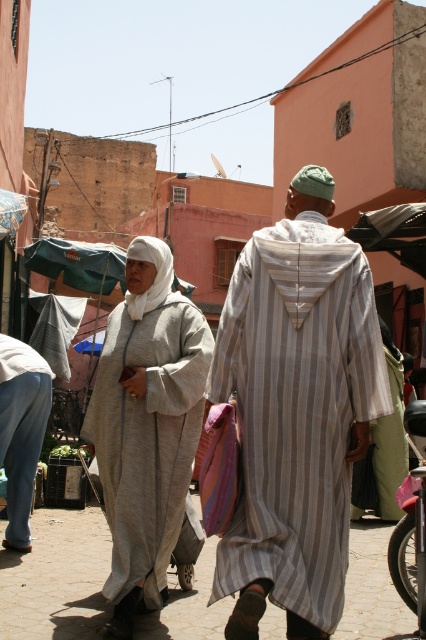
You are a photographer trying to capture both the light gray woolen dress at center and the denim jeans at lower left in a single frame. Based on their positions, which direction should you move your camera to include both subjects?

The light gray woolen dress at center is to the right of denim jeans at lower left. To include both in the frame, move the camera to the left to capture the denim jeans at lower left and then pan towards the right to include the light gray woolen dress at center.

Based on the scene description, where is the striped cotton robe at center located in the image?

The striped cotton robe at center is located at point 0.644 on the x axis and 0.695 on the y axis.